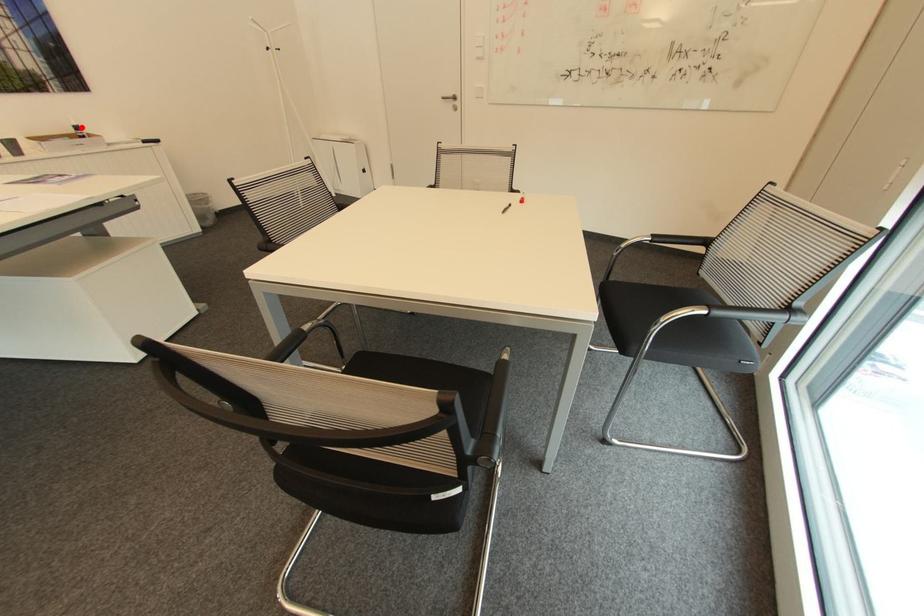
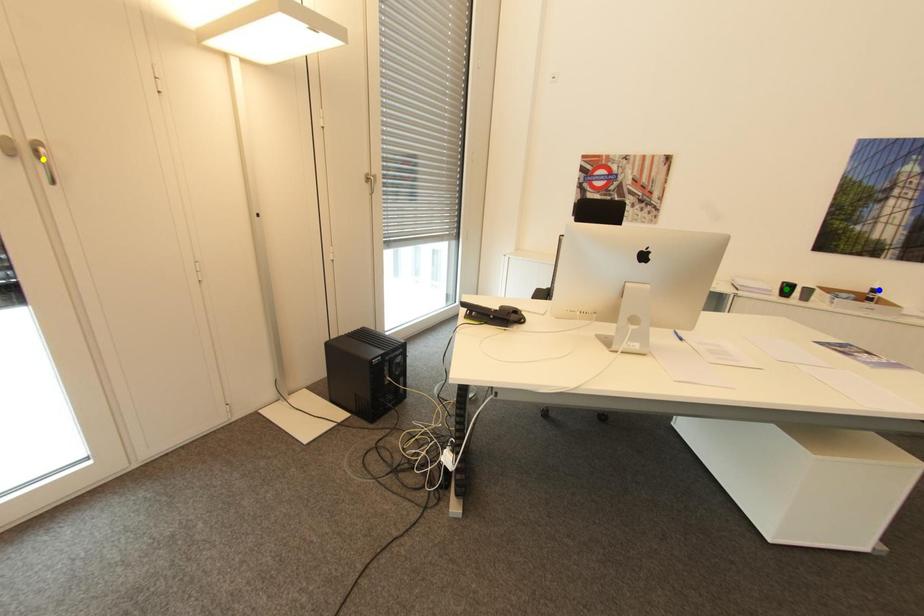
Question: I am providing you with two images of the same scene from different viewpoints. A red point is marked on the first image. You are given multiple points on the second image. Which spot in image 2 lines up with the point in image 1?

Choices:
 (A) blue point
 (B) green point
 (C) yellow point

Answer: (A)